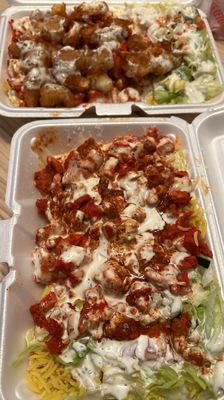
Locate an element on the screen. white food container is located at coordinates (155, 132), (23, 184), (19, 14).